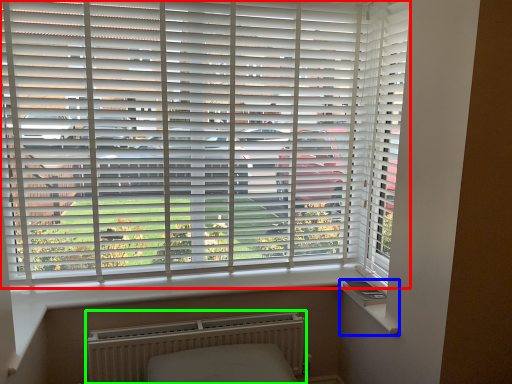
Question: Considering the real-world distances, which object is closest to window blind (highlighted by a red box)? window sill (highlighted by a blue box) or radiator (highlighted by a green box).

Choices:
 (A) window sill
 (B) radiator

Answer: (B)